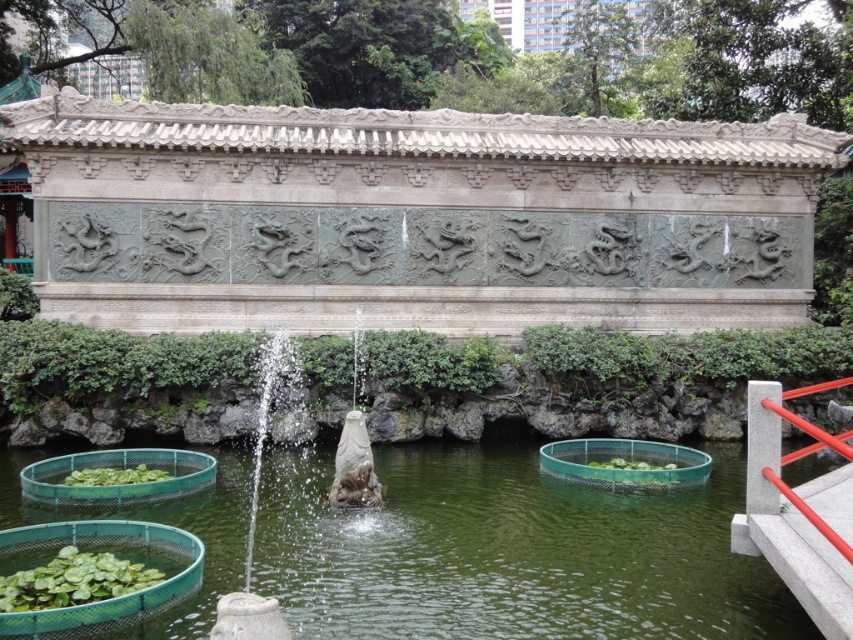
You are standing at the center of the garden and want to locate the green water at fountain center. According to the coordinates provided, in which direction should you move from the center to reach it?

The green water at fountain center is located at coordinates point (509, 550). Since the center of the garden is at point (426, 320), you should move towards the right direction to reach it.